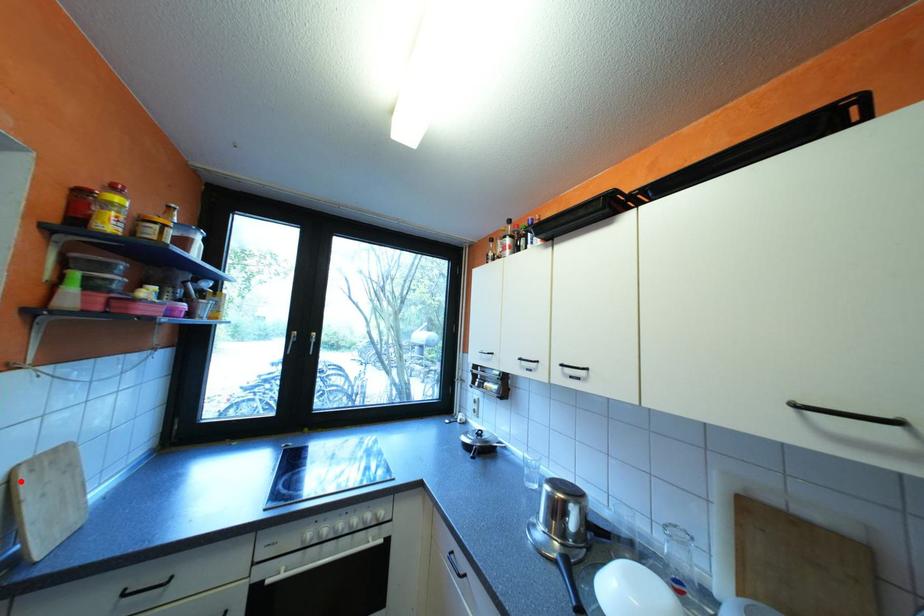
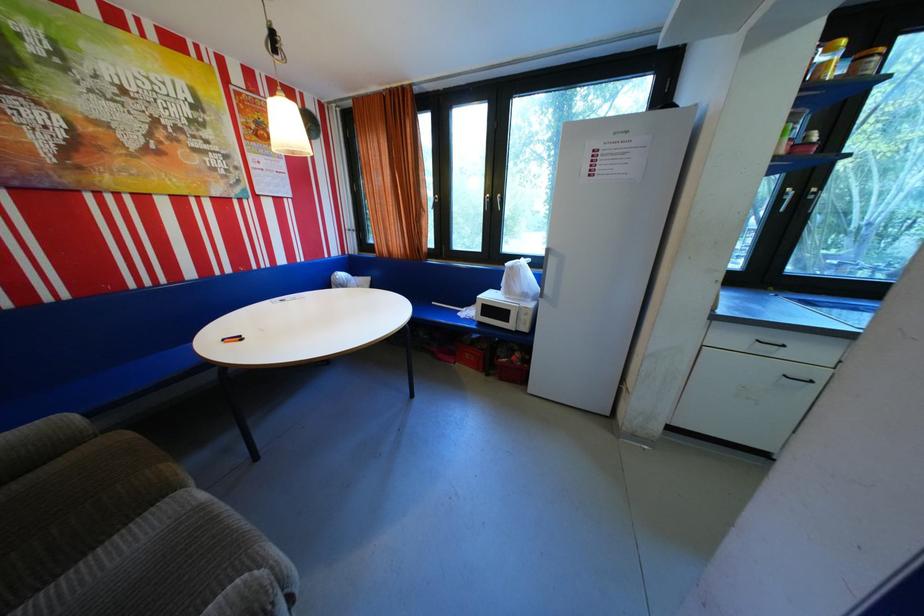
Question: I am providing you with two images of the same scene from different viewpoints. A red point is marked on the first image. Can you still see the location of the red point in image 2?

Choices:
 (A) Yes
 (B) No

Answer: (B)